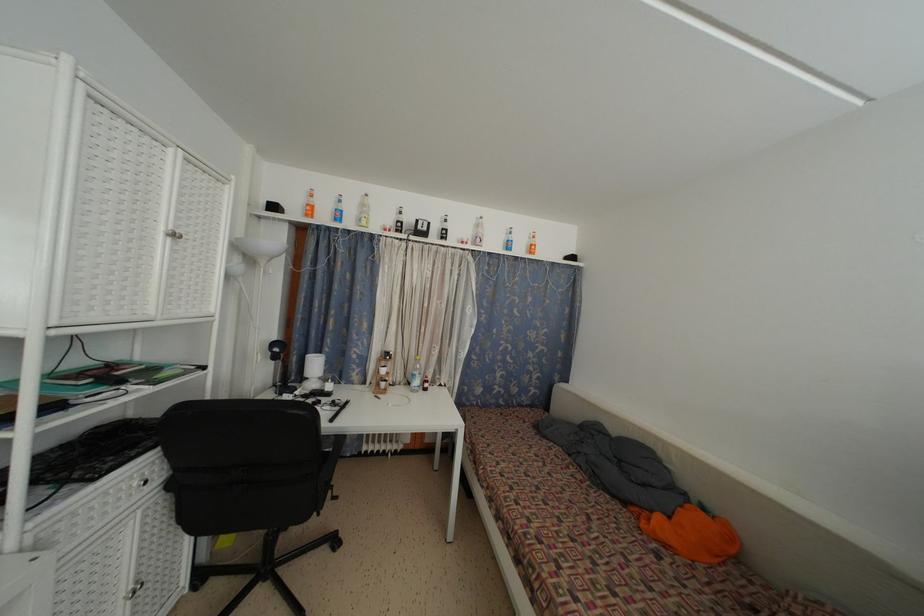
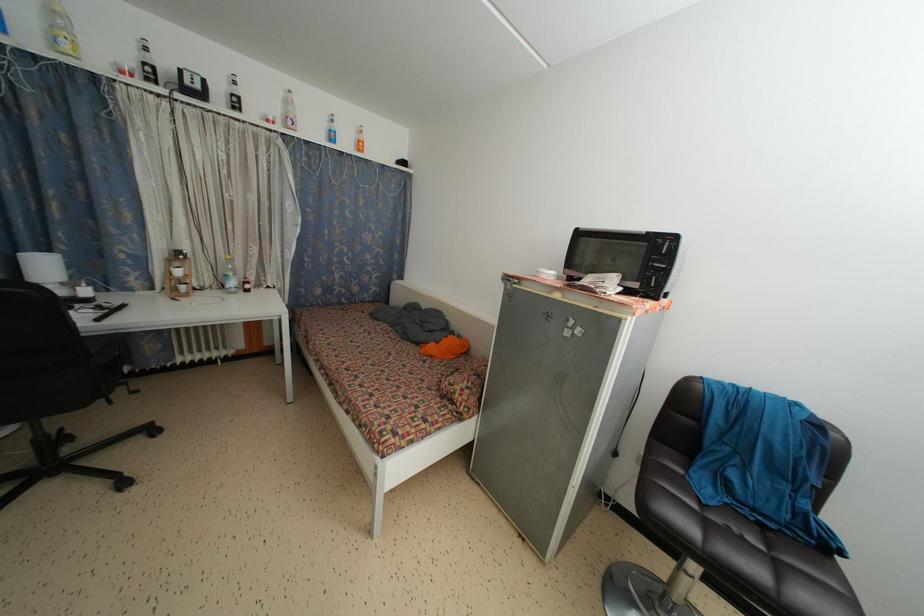
The point at (420, 387) is marked in the first image. Where is the corresponding point in the second image?

(237, 289)